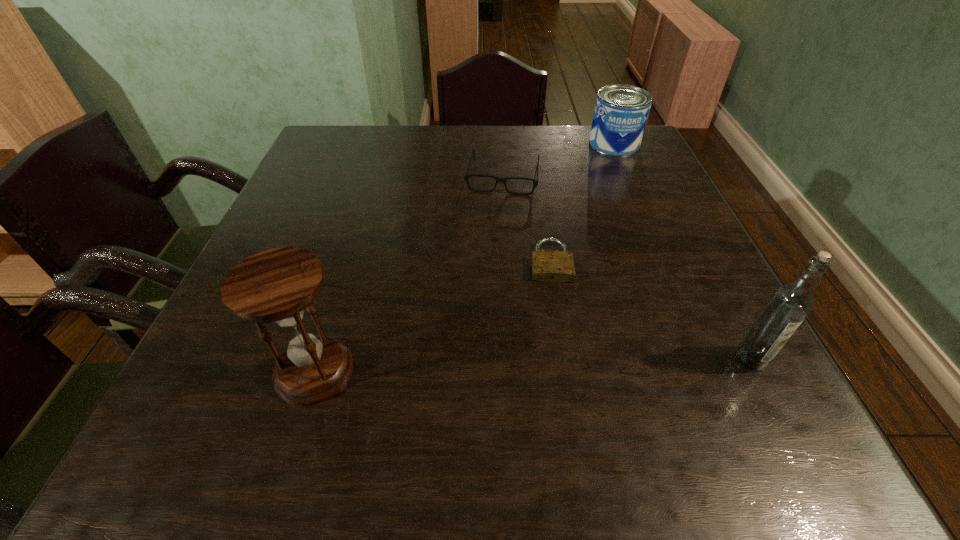
Image resolution: width=960 pixels, height=540 pixels. What are the coordinates of `free space on the desktop that is between the leftmost object and the vodka and is positioned on the keyhole side of the shortest object` in the screenshot? It's located at (560, 364).

Locate an element on the screen. This screenshot has width=960, height=540. free space on the desktop that is between the leftmost object and the vodka and is positioned on the front label of the can is located at coordinates (526, 365).

Identify the location of free space on the desktop that is between the hourglass and the vodka and is positioned on the front-facing side of the second shortest object. (470, 367).